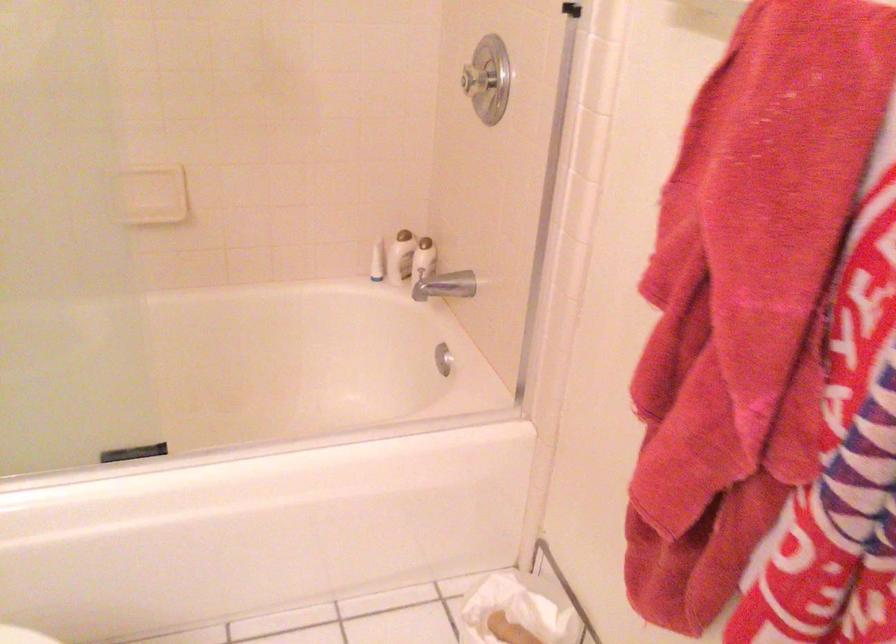
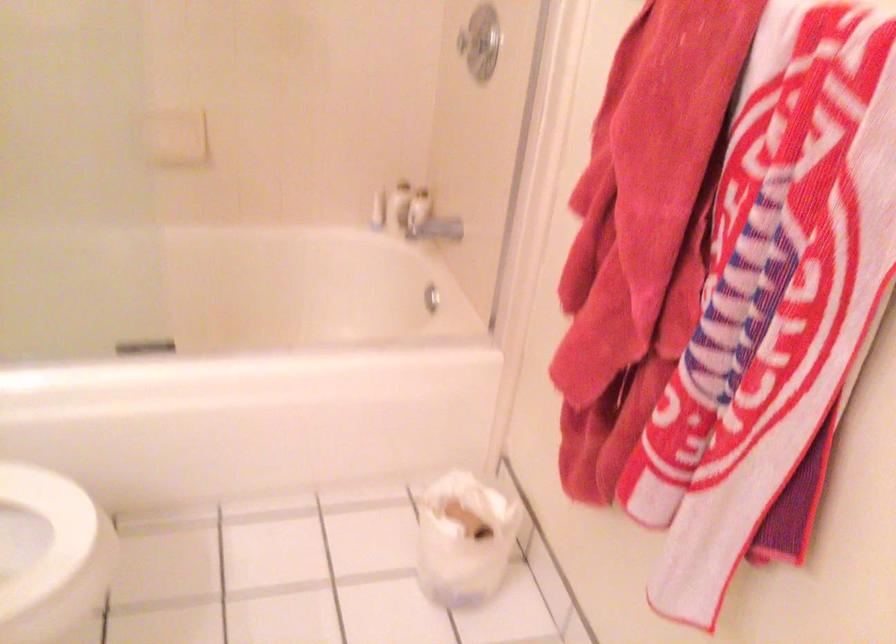
Locate, in the second image, the point that corresponds to the point at 433,275 in the first image.

(429, 221)